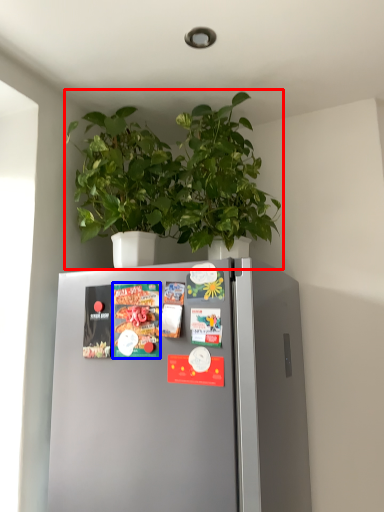
Question: Which object is further to the camera taking this photo, houseplant (highlighted by a red box) or magazine (highlighted by a blue box)?

Choices:
 (A) houseplant
 (B) magazine

Answer: (B)